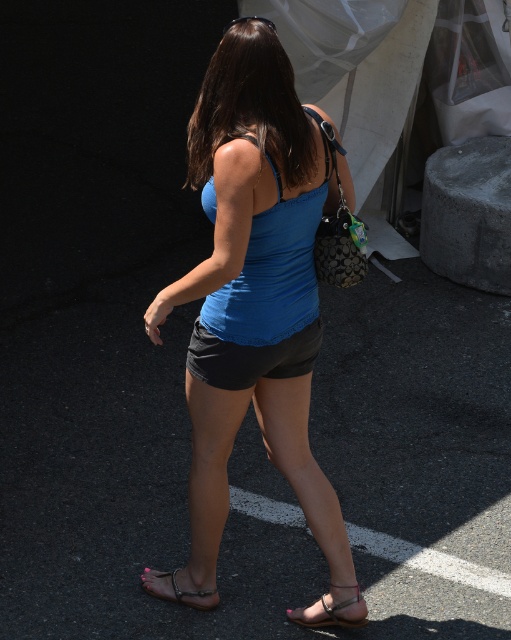
Based on the photo, based on the scene description, can you determine which object is closer to the camera between the shiny brown hair at center and the black cotton shorts at center?

The shiny brown hair at center is in front of the black cotton shorts at center, so the shiny brown hair at center is closer to the camera.

You are trying to locate the shiny brown hair at center in the image. According to the coordinates provided, where exactly is it positioned?

The shiny brown hair at center is located at coordinates point (250, 104).